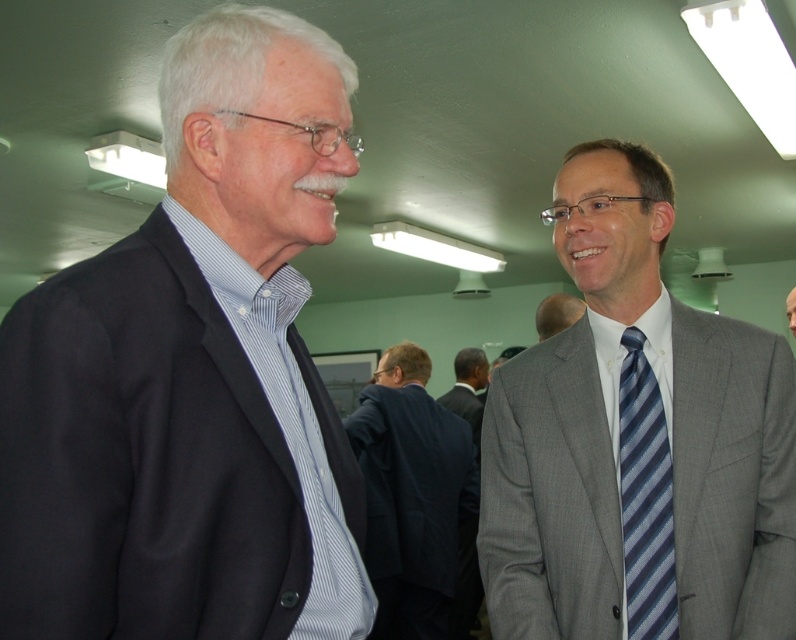
Does point (380, 588) lie in front of point (654, 401)?

No.

Is dark blue suit at center behind blue striped tie at right?

Yes, it is.

Is point (389, 420) farther from camera compared to point (633, 500)?

Yes.

You are a GUI agent. You are given a task and a screenshot of the screen. Output one action in this format:
    pyautogui.click(x=<x>, y=<y>)
    Task: Click on the dark blue suit at center
    
    Given the screenshot: What is the action you would take?
    pyautogui.click(x=412, y=493)

Does blue striped tie at right have a greater width compared to gray suit at center?

No, blue striped tie at right is not wider than gray suit at center.

Between point (661, 486) and point (548, 314), which one is positioned in front?

Point (661, 486) is more forward.

Where is `blue striped tie at right`? Image resolution: width=796 pixels, height=640 pixels. blue striped tie at right is located at coordinates (646, 497).

Consider the image. Is matte black suit at left bigger than gray textured suit at right?

Incorrect, matte black suit at left is not larger than gray textured suit at right.

The image size is (796, 640). What do you see at coordinates (193, 374) in the screenshot?
I see `matte black suit at left` at bounding box center [193, 374].

Which is behind, point (267, 632) or point (642, 577)?

The point (642, 577) is behind.

You are a GUI agent. You are given a task and a screenshot of the screen. Output one action in this format:
    pyautogui.click(x=<x>, y=<y>)
    Task: Click on the matte black suit at left
    
    Given the screenshot: What is the action you would take?
    pyautogui.click(x=193, y=374)